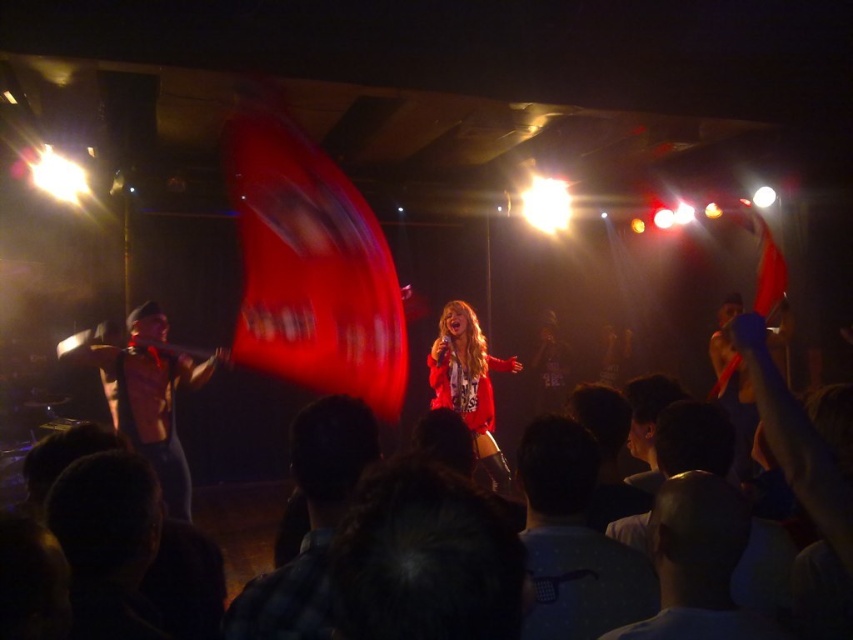
Who is positioned more to the left, dark gray cotton shirt at lower right or matte red jacket at center?

From the viewer's perspective, dark gray cotton shirt at lower right appears more on the left side.

Which is below, dark gray cotton shirt at lower right or matte red jacket at center?

Positioned lower is matte red jacket at center.

Is point (550, 499) positioned after point (492, 467)?

No, (550, 499) is closer to viewer.

Identify the location of dark gray cotton shirt at lower right. This screenshot has width=853, height=640. (573, 540).

Can you confirm if shiny silver sword at left is positioned below matte red jacket at center?

Actually, shiny silver sword at left is above matte red jacket at center.

Who is higher up, shiny silver sword at left or matte red jacket at center?

Positioned higher is shiny silver sword at left.

Between point (125, 326) and point (476, 449), which one is positioned in front?

Positioned in front is point (476, 449).

The height and width of the screenshot is (640, 853). Identify the location of shiny silver sword at left. (152, 397).

Is dark gray cotton shirt at lower right shorter than plaid shirt at center?

Correct, dark gray cotton shirt at lower right is not as tall as plaid shirt at center.

Which is above, dark gray cotton shirt at lower right or plaid shirt at center?

plaid shirt at center is higher up.

Describe the element at coordinates (573, 540) in the screenshot. Image resolution: width=853 pixels, height=640 pixels. I see `dark gray cotton shirt at lower right` at that location.

Locate an element on the screen. This screenshot has width=853, height=640. dark gray cotton shirt at lower right is located at coordinates (573, 540).